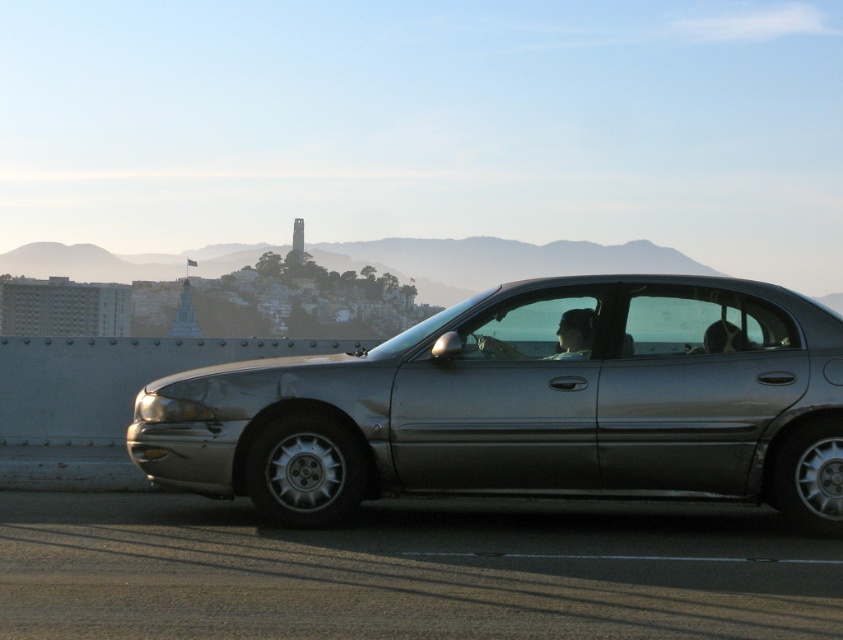
Is satin silver sedan at center to the right of smooth skin face at center from the viewer's perspective?

In fact, satin silver sedan at center is to the left of smooth skin face at center.

Who is shorter, satin silver sedan at center or smooth skin face at center?

Standing shorter between the two is smooth skin face at center.

Which is in front, point (505, 378) or point (525, 358)?

Point (505, 378)

Identify the location of satin silver sedan at center. This screenshot has width=843, height=640. (527, 406).